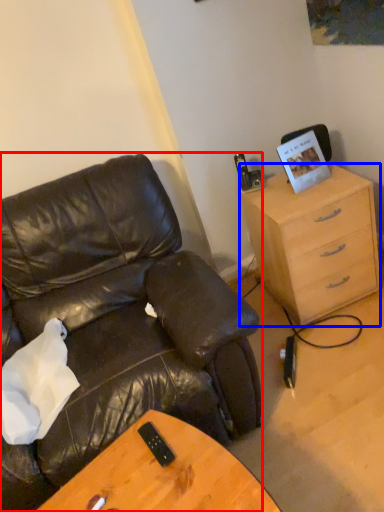
Question: Which of the following is the farthest to the observer, chair (highlighted by a red box) or cabinetry (highlighted by a blue box)?

Choices:
 (A) chair
 (B) cabinetry

Answer: (B)